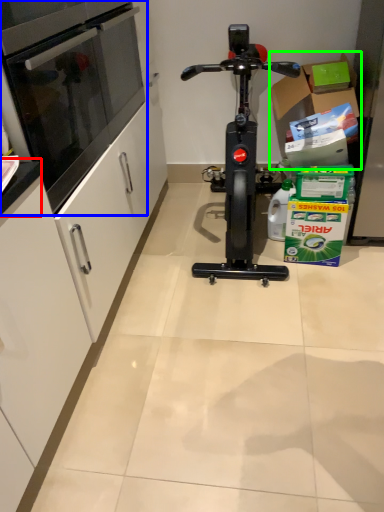
Question: Estimate the real-world distances between objects in this image. Which object is closer to counter top (highlighted by a red box), oven (highlighted by a blue box) or cardboard box (highlighted by a green box)?

Choices:
 (A) oven
 (B) cardboard box

Answer: (A)